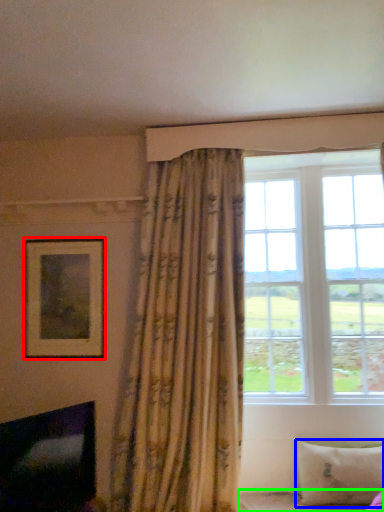
Question: Which object is the closest to the picture frame (highlighted by a red box)? Choose among these: pillow (highlighted by a blue box) or bed frame (highlighted by a green box).

Choices:
 (A) pillow
 (B) bed frame

Answer: (B)